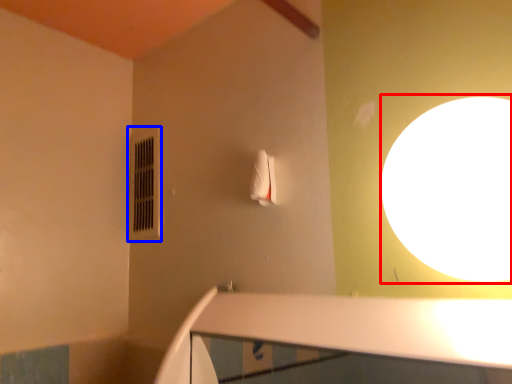
Question: Which object appears farthest to the camera in this image, light (highlighted by a red box) or air conditioner (highlighted by a blue box)?

Choices:
 (A) light
 (B) air conditioner

Answer: (B)